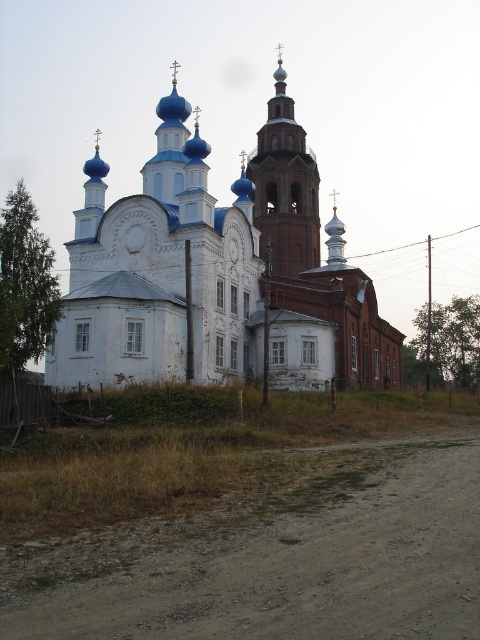
Who is lower down, dusty gravel road at lower center or smooth brown tower at center?

Positioned lower is dusty gravel road at lower center.

What do you see at coordinates (276, 556) in the screenshot?
I see `dusty gravel road at lower center` at bounding box center [276, 556].

This screenshot has height=640, width=480. In order to click on dusty gravel road at lower center in this screenshot , I will do `click(276, 556)`.

Does white wooden church at center have a larger size compared to smooth brown tower at center?

Yes, white wooden church at center is bigger than smooth brown tower at center.

Is white wooden church at center smaller than smooth brown tower at center?

Incorrect, white wooden church at center is not smaller in size than smooth brown tower at center.

Describe the element at coordinates (217, 273) in the screenshot. I see `white wooden church at center` at that location.

The width and height of the screenshot is (480, 640). Find the location of `white wooden church at center`. white wooden church at center is located at coordinates (217, 273).

Which is behind, point (132, 611) or point (153, 330)?

Positioned behind is point (153, 330).

Is point (462, 476) more distant than point (284, 316)?

No, it is not.

I want to click on dusty gravel road at lower center, so point(276,556).